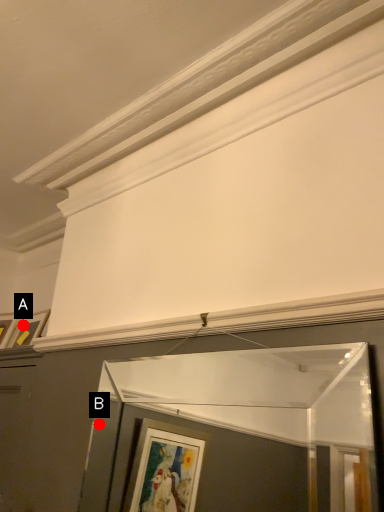
Question: Two points are circled on the image, labeled by A and B beside each circle. Which point is farther to the camera?

Choices:
 (A) A is further
 (B) B is further

Answer: (B)